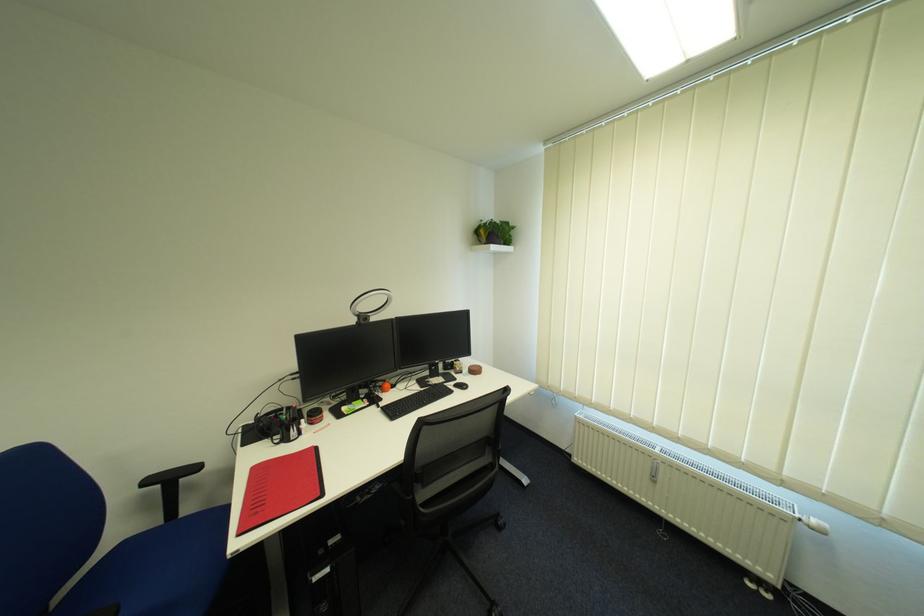
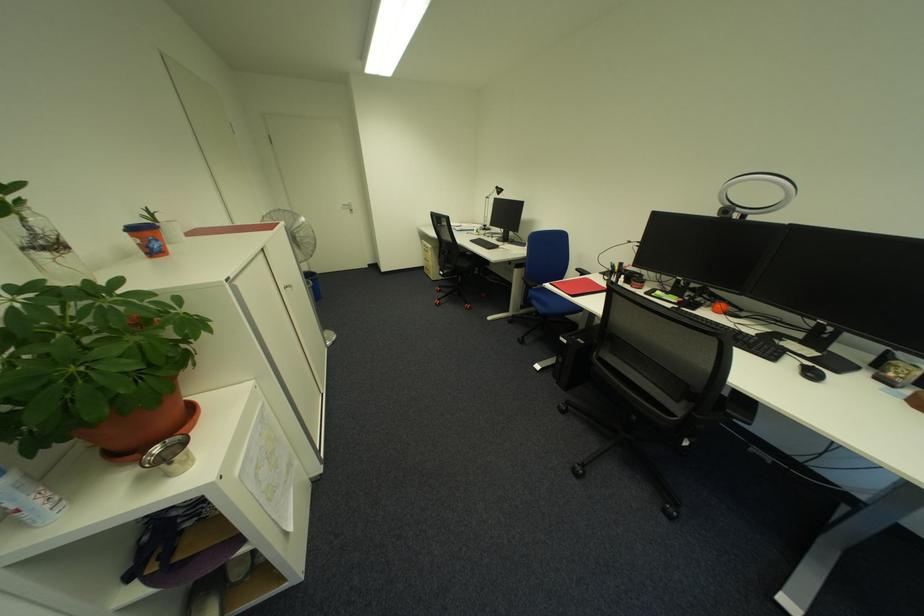
Where in the second image is the point corresponding to pixel 249 536 from the first image?

(560, 285)